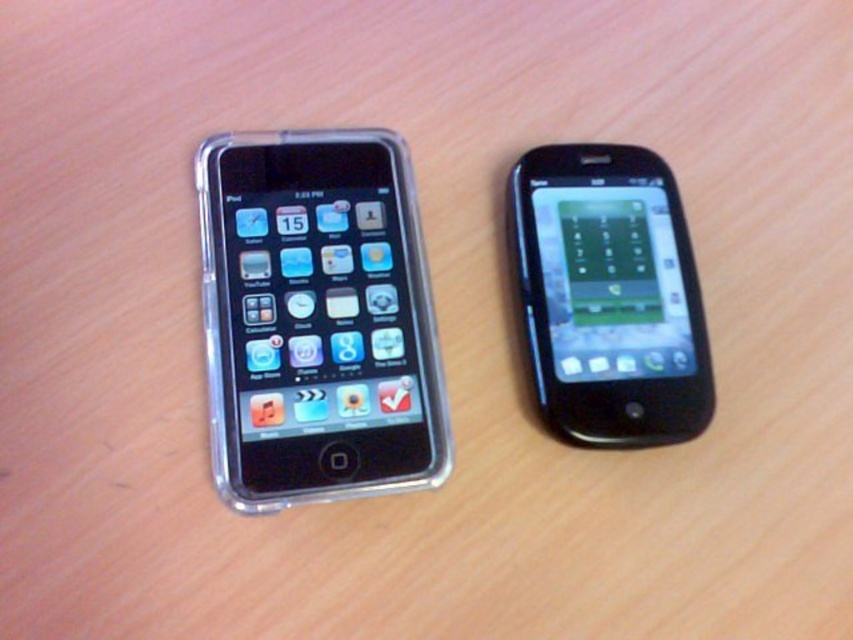
You are trying to place both the clear plastic phone at left and the black glossy smartphone at right into a vertical phone holder that can only accommodate one phone at a time. Based on their sizes, which phone would fit better in the holder?

The clear plastic phone at left is much taller than the black glossy smartphone at right, so it would fit better in the vertical phone holder designed for taller devices.

You are holding a small toy drone that needs to hover 1.2 meters away from the clear plastic phone at left. Can the drone hover at the same distance as the phone from the viewer?

The clear plastic phone at left is already positioned 1.20 meters away from the viewer. Therefore, the drone can hover at the same distance by maintaining that 1.20 meter distance from the viewer.

You are arranging two smartphones on a shelf. The clear plastic phone at left is currently under the black glossy smartphone at right. If you want to place them side by side without overlapping, which phone should you move and where?

The clear plastic phone at left is positioned under the black glossy smartphone at right. To place them side by side without overlapping, you should move the clear plastic phone at left to the right side or move the black glossy smartphone at right to the left side so they are aligned horizontally.